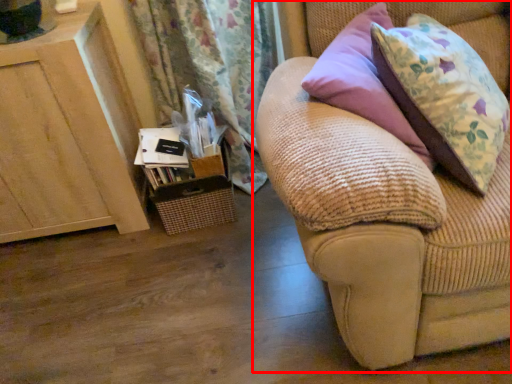
Question: From the image's perspective, what is the correct spatial relationship of studio couch (annotated by the red box) in relation to furniture?

Choices:
 (A) below
 (B) above

Answer: (B)